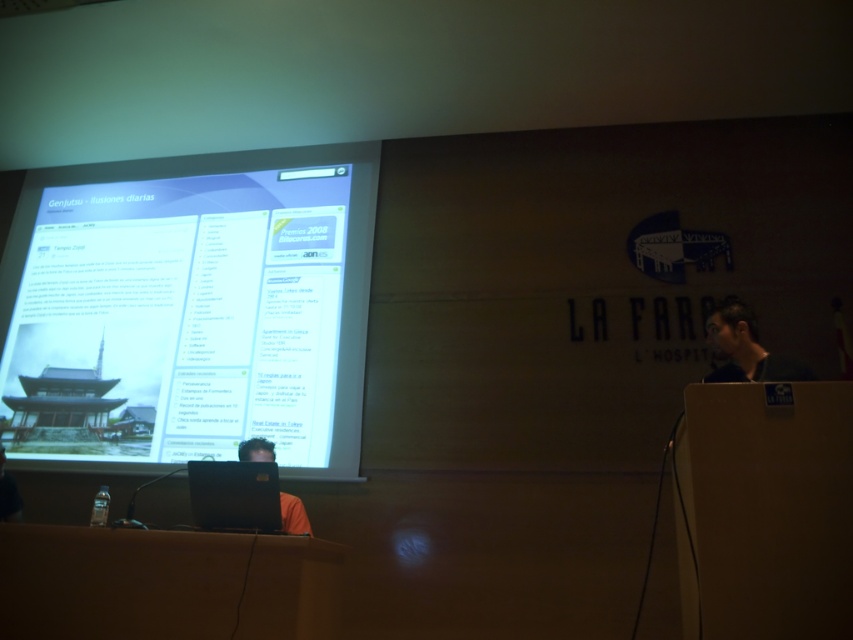
Is white glossy projector screen at upper center taller than matte black laptop at center?

Yes.

The width and height of the screenshot is (853, 640). What do you see at coordinates (190, 307) in the screenshot?
I see `white glossy projector screen at upper center` at bounding box center [190, 307].

Where is `white glossy projector screen at upper center`? The height and width of the screenshot is (640, 853). white glossy projector screen at upper center is located at coordinates (x=190, y=307).

Is matte black laptop at right bigger than matte black laptop at center?

Actually, matte black laptop at right might be smaller than matte black laptop at center.

Who is higher up, matte black laptop at right or matte black laptop at center?

matte black laptop at right is higher up.

I want to click on matte black laptop at right, so click(x=747, y=348).

Where is `matte black laptop at right`? The width and height of the screenshot is (853, 640). matte black laptop at right is located at coordinates (747, 348).

Who is shorter, black matte laptop at center or matte black laptop at right?

black matte laptop at center

How much distance is there between black matte laptop at center and matte black laptop at right?

The distance of black matte laptop at center from matte black laptop at right is 1.82 meters.

Between point (245, 516) and point (757, 344), which one is positioned in front?

Point (245, 516) is in front.

This screenshot has width=853, height=640. I want to click on black matte laptop at center, so click(x=234, y=496).